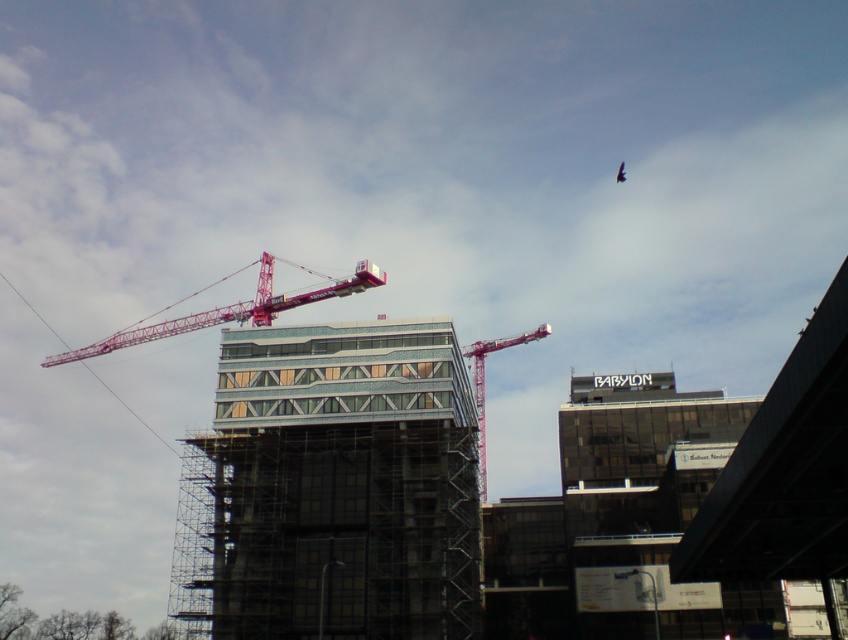
You are standing in front of the construction site and want to determine the relative positions of two points marked on the blueprint. Which point is closer to you, point 1 at coordinates point (x=389, y=385) or point 2 at coordinates point (x=505, y=339)?

Point 1 at coordinates point (x=389, y=385) is closer to the viewer than point 2 at coordinates point (x=505, y=339).

You are a drone operator tasked with capturing aerial footage of the construction site. The drone must fly from the red crane on the left to the glassy steel building at center without crossing any obstacles. Given the coordinates provided, can the drone safely navigate this path?

The glassy steel building at center is located at coordinates point (x=336, y=486), so the drone can safely navigate from the red crane on the left to the glassy steel building at center as there are no obstacles mentioned in the scene description that would block this path.

You are an architect observing the construction site. You notice two cranes labeled pink metallic crane at upper center and metallic pink crane at upper center. Which one is larger in size?

The pink metallic crane at upper center is bigger than the metallic pink crane at upper center.